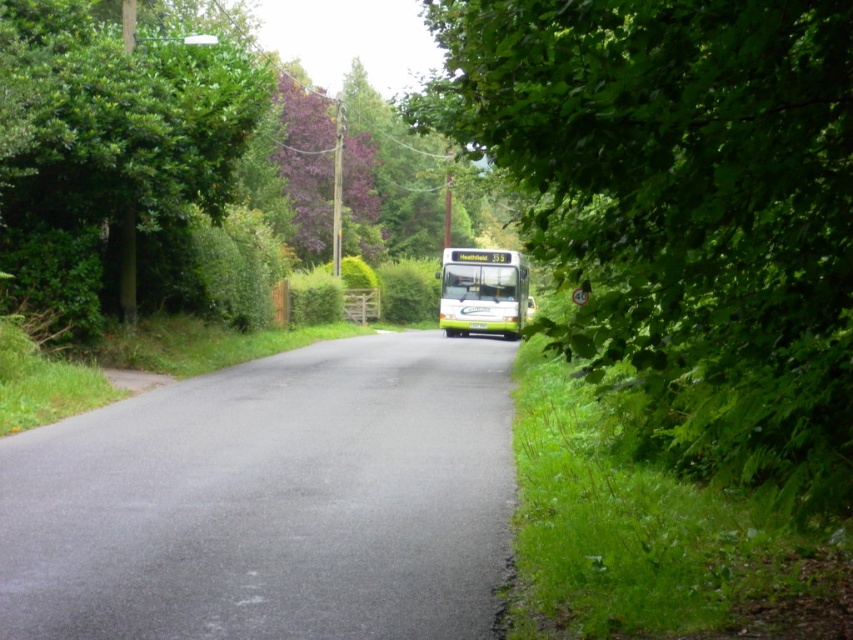
You are a driver approaching the black asphalt road at center and the purple leafy tree at upper center in the scene. Which object takes up more space in the image?

The purple leafy tree at upper center occupies more space in the image than the black asphalt road at center.

You are a driver approaching the green leafy tree at center and the black asphalt road at center. Which one is wider from your perspective?

The black asphalt road at center is wider than the green leafy tree at center.